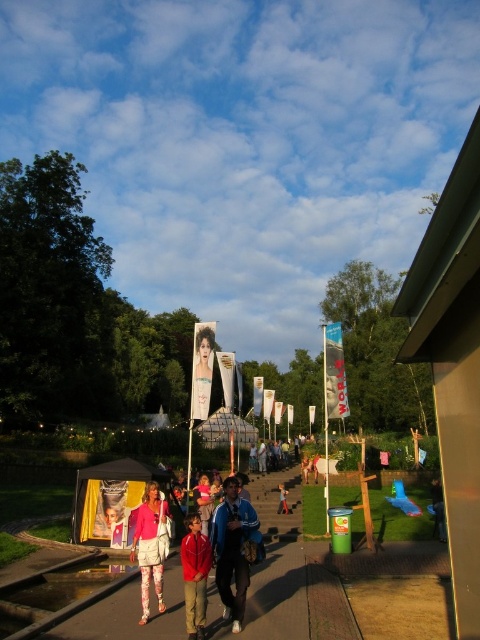
Which of these two, blue fabric jacket at center or matte pink dress at center, stands shorter?

matte pink dress at center

Which is more to the right, blue fabric jacket at center or matte pink dress at center?

blue fabric jacket at center is more to the right.

The image size is (480, 640). Describe the element at coordinates (233, 548) in the screenshot. I see `blue fabric jacket at center` at that location.

I want to click on blue fabric jacket at center, so click(x=233, y=548).

Does brown concrete pavement at center have a greater width compared to smooth skin portrait at center?

Indeed, brown concrete pavement at center has a greater width compared to smooth skin portrait at center.

This screenshot has height=640, width=480. Describe the element at coordinates (277, 564) in the screenshot. I see `brown concrete pavement at center` at that location.

Does point (96, 618) come behind point (205, 406)?

No, it is not.

The height and width of the screenshot is (640, 480). I want to click on brown concrete pavement at center, so click(x=277, y=564).

Consider the image. Does smooth skin portrait at center have a lesser height compared to matte pink dress at center?

No.

Between smooth skin portrait at center and matte pink dress at center, which one is positioned higher?

smooth skin portrait at center

Between point (215, 328) and point (205, 484), which one is positioned behind?

The point (215, 328) is more distant.

Identify the location of smooth skin portrait at center. (202, 369).